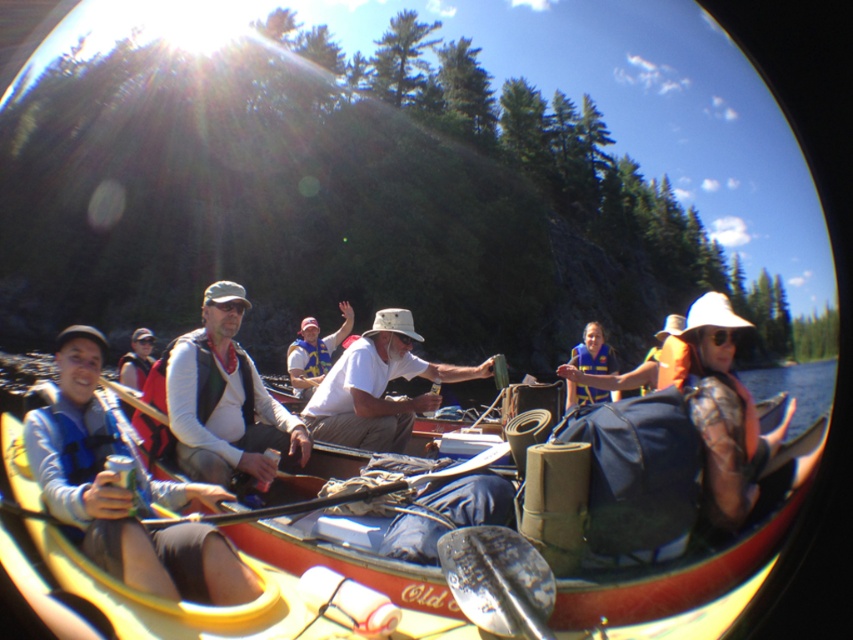
Question: Among these objects, which one is nearest to the camera?

Choices:
 (A) orange life vest at center
 (B) yellow plastic canoe at lower left

Answer: (B)

Question: Which is nearer to the white cotton shirt at center?

Choices:
 (A) blue life vest at center
 (B) matte blue life vest at left
 (C) orange life vest at center
 (D) white life vest at center

Answer: (B)

Question: Does matte blue life vest at left appear over wooden textured paddle at center?

Choices:
 (A) yes
 (B) no

Answer: (A)

Question: Estimate the real-world distances between objects in this image. Which object is closer to the wooden textured paddle at center?

Choices:
 (A) white life vest at center
 (B) orange life vest at center
 (C) yellow plastic canoe at lower left

Answer: (C)

Question: Is wooden textured paddle at center to the left of blue life vest at center from the viewer's perspective?

Choices:
 (A) no
 (B) yes

Answer: (B)

Question: Is camouflage fabric shirt at right bigger than white cotton shirt at center?

Choices:
 (A) yes
 (B) no

Answer: (A)